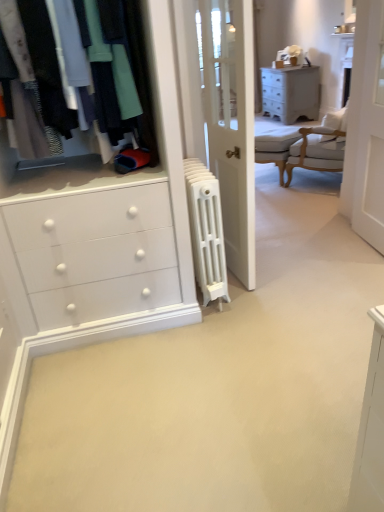
I want to click on free location to the left of white wood screen door at upper right, so click(322, 251).